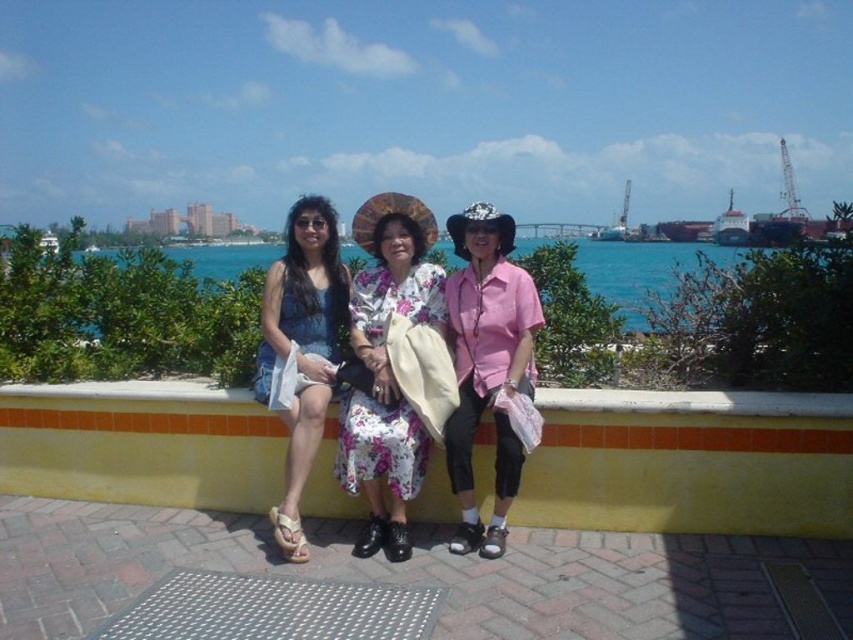
Is pink matte shirt at center shorter than denim dress at center?

Yes.

Is pink matte shirt at center above denim dress at center?

Correct, pink matte shirt at center is located above denim dress at center.

Between point (514, 440) and point (287, 292), which one is positioned in front?

Point (514, 440) is more forward.

This screenshot has width=853, height=640. I want to click on pink matte shirt at center, so click(x=486, y=364).

Can you confirm if floral fabric dress at center is smaller than denim dress at center?

Yes.

Is floral fabric dress at center in front of denim dress at center?

No, it is not.

Which is behind, point (350, 310) or point (283, 541)?

Positioned behind is point (350, 310).

Locate an element on the screen. This screenshot has width=853, height=640. floral fabric dress at center is located at coordinates (387, 369).

Can you confirm if yellow tile ledge at center is positioned to the left of blue water at center?

In fact, yellow tile ledge at center is to the right of blue water at center.

Who is positioned more to the left, yellow tile ledge at center or blue water at center?

blue water at center is more to the left.

Is point (223, 461) more distant than point (639, 307)?

No, it is in front of (639, 307).

What are the coordinates of `yellow tile ledge at center` in the screenshot? It's located at (691, 461).